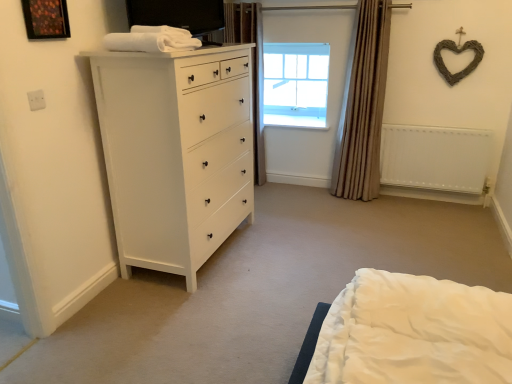
In order to click on free point below white matte radiator at right (from a real-world perspective) in this screenshot , I will do `click(440, 196)`.